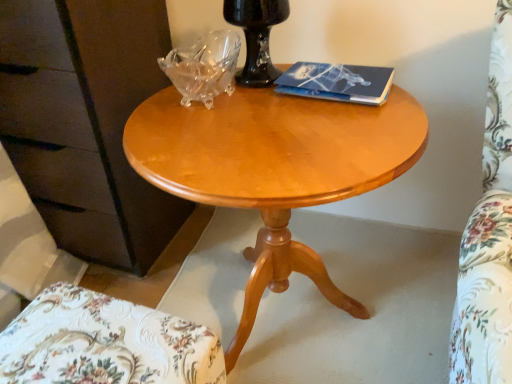
Question: Considering the positions of blue matte paper at upper right and white floral fabric chair at lower left in the image, is blue matte paper at upper right bigger or smaller than white floral fabric chair at lower left?

Choices:
 (A) small
 (B) big

Answer: (A)

Question: From their relative heights in the image, would you say blue matte paper at upper right is taller or shorter than white floral fabric chair at lower left?

Choices:
 (A) short
 (B) tall

Answer: (A)

Question: Based on their relative distances, which object is nearer to the blue matte paper at upper right?

Choices:
 (A) black glass vase at upper center
 (B) matte brown dresser at left
 (C) light wood/finish coffee table at center
 (D) white floral fabric chair at lower left

Answer: (A)

Question: Estimate the real-world distances between objects in this image. Which object is closer to the blue matte paper at upper right?

Choices:
 (A) black glass vase at upper center
 (B) matte brown dresser at left
 (C) white floral fabric chair at lower left
 (D) light wood/finish coffee table at center

Answer: (A)